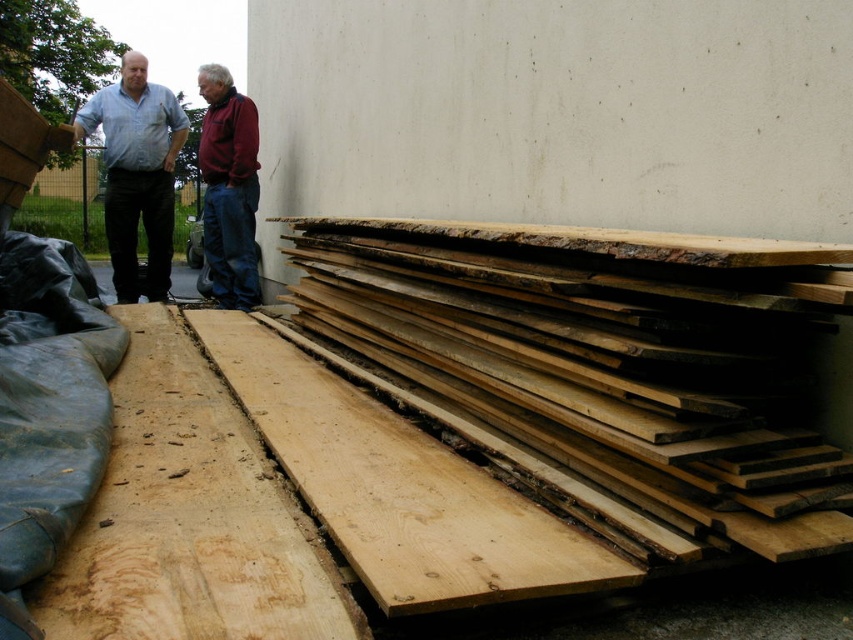
You are a carpenter assessing the layout of the wooden materials. You see the natural wood boards at right and the natural wood plank at lower left. Which one is located to the right of the other?

The natural wood boards at right is positioned on the right side of natural wood plank at lower left.

You are a construction worker needing to pass between the light blue shirt at left and the maroon fleece jacket at center. The space between them is 15.45 inches. Can you comfortably walk through this space?

The space between the light blue shirt at left and the maroon fleece jacket at center is 15.45 inches. Since an average person requires about 24 inches to comfortably walk, this space is too narrow.